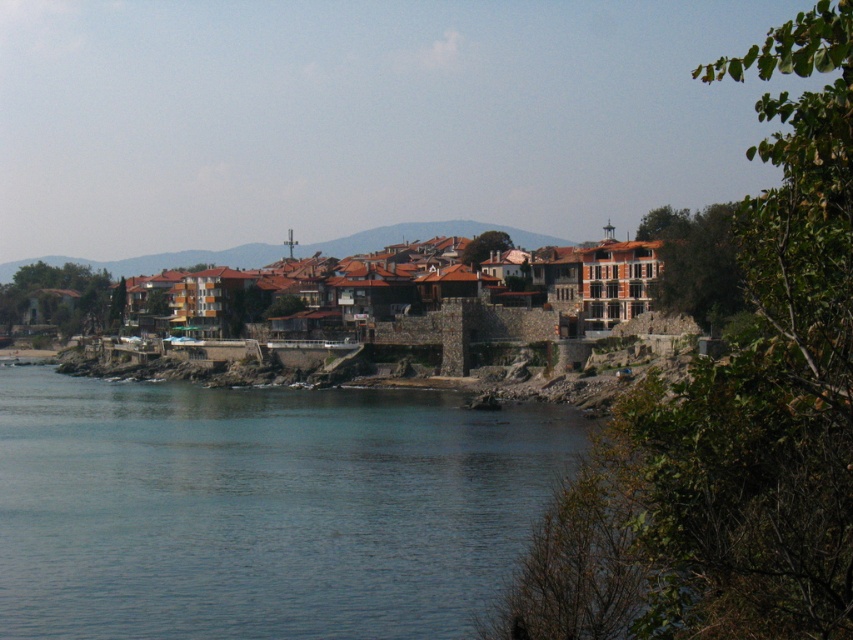
Question: Considering the relative positions of brown stone buildings at center and brown tiled roofs at center in the image provided, where is brown stone buildings at center located with respect to brown tiled roofs at center?

Choices:
 (A) below
 (B) above

Answer: (A)

Question: Is blue water at lower left to the right of brown stone buildings at center from the viewer's perspective?

Choices:
 (A) yes
 (B) no

Answer: (A)

Question: Does blue water at lower left come in front of brown tiled roofs at center?

Choices:
 (A) no
 (B) yes

Answer: (B)

Question: Which of the following is the closest to the observer?

Choices:
 (A) brown tiled roofs at center
 (B) blue water at lower left

Answer: (B)

Question: Which point appears closest to the camera in this image?

Choices:
 (A) (413, 230)
 (B) (223, 428)
 (C) (265, 248)

Answer: (B)

Question: Which of the following is the farthest from the observer?

Choices:
 (A) brown stone buildings at center
 (B) brown tiled roofs at center

Answer: (B)